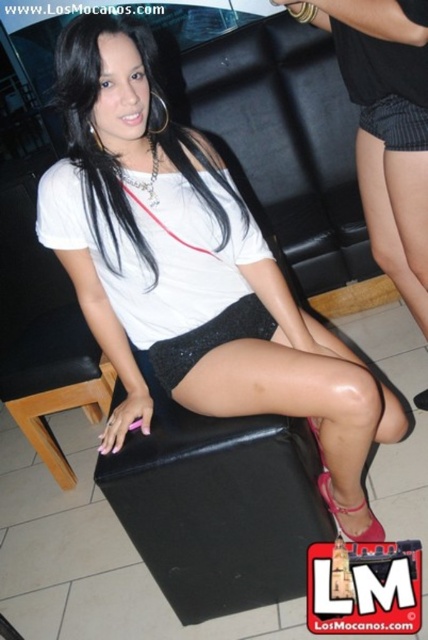
The height and width of the screenshot is (640, 428). What are the coordinates of `shiny black shorts at center` in the screenshot? It's located at (187, 266).

Who is more forward, [146,342] or [166,387]?

Point [166,387] is more forward.

Who is more distant from viewer, (214, 202) or (217, 340)?

Point (217, 340)

The image size is (428, 640). In order to click on shiny black shorts at center in this screenshot , I will do `click(187, 266)`.

Does shiny black shorts at center have a greater width compared to black leather stool at center?

Yes, shiny black shorts at center is wider than black leather stool at center.

Is shiny black shorts at center to the left of black leather stool at center from the viewer's perspective?

Yes, shiny black shorts at center is to the left of black leather stool at center.

Based on the photo, who is more distant from viewer, (163, 348) or (252, 534)?

The point (163, 348) is more distant.

Where is `shiny black shorts at center`? The width and height of the screenshot is (428, 640). shiny black shorts at center is located at coordinates (187, 266).

Who is positioned more to the left, black leather stool at center or shiny pink sandal at lower right?

From the viewer's perspective, black leather stool at center appears more on the left side.

Find the location of a particular element. black leather stool at center is located at coordinates (217, 504).

Is point (169, 556) less distant than point (332, 500)?

Yes, point (169, 556) is closer to viewer.

I want to click on black leather stool at center, so click(217, 504).